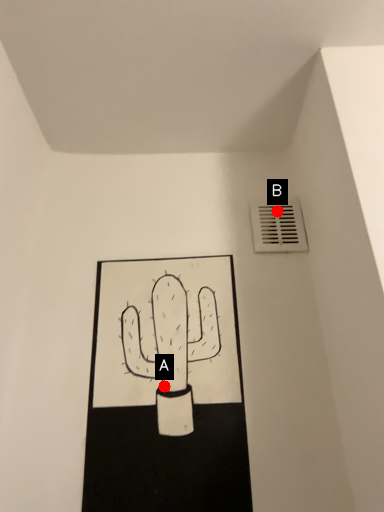
Question: Two points are circled on the image, labeled by A and B beside each circle. Which point is farther to the camera?

Choices:
 (A) A is further
 (B) B is further

Answer: (B)